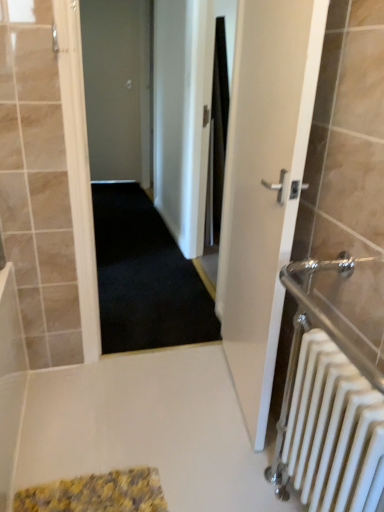
Question: Considering the relative positions of white glossy door at center right, which is the 1th door from front to back, and black carpet at center in the image provided, is white glossy door at center right, which is the 1th door from front to back, to the left or to the right of black carpet at center?

Choices:
 (A) left
 (B) right

Answer: (B)

Question: Looking at the image, does white glossy door at center right, which is the 1th door in bottom-to-top order, seem bigger or smaller compared to black carpet at center?

Choices:
 (A) small
 (B) big

Answer: (A)

Question: Which of these objects is positioned farthest from the dark carpet at center?

Choices:
 (A) white metallic radiator at right
 (B) white glossy door at center right, which appears as the 2th door when viewed from the left
 (C) black carpet at center
 (D) black fabric shower curtain at center
 (E) matte gray door at center, which ranks as the first door in top-to-bottom order

Answer: (A)

Question: Which object is the closest to the black fabric shower curtain at center?

Choices:
 (A) matte gray door at center, which is counted as the 2th door, starting from the front
 (B) white metallic radiator at right
 (C) black carpet at center
 (D) white glossy door at center right, which is the 1th door from front to back
 (E) dark carpet at center

Answer: (C)